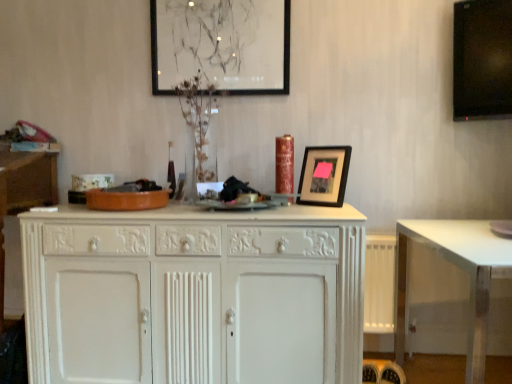
Question: Would you consider black matte picture frame at upper center, which appears as the second picture frame when viewed from the left, to be distant from white painted wood cabinet at center?

Choices:
 (A) yes
 (B) no

Answer: (B)

Question: Does black matte picture frame at upper center, which appears as the second picture frame when viewed from the left, have a larger size compared to white painted wood cabinet at center?

Choices:
 (A) no
 (B) yes

Answer: (A)

Question: From the image's perspective, is black matte picture frame at upper center, acting as the first picture frame starting from the right, located beneath white painted wood cabinet at center?

Choices:
 (A) yes
 (B) no

Answer: (B)

Question: Is black matte picture frame at upper center, which is counted as the 1th picture frame, starting from the bottom, thinner than white painted wood cabinet at center?

Choices:
 (A) no
 (B) yes

Answer: (B)

Question: Could you tell me if black matte picture frame at upper center, the 2th picture frame in the back-to-front sequence, is facing white painted wood cabinet at center?

Choices:
 (A) no
 (B) yes

Answer: (A)

Question: Is black matte picture frame at upper center, which is counted as the 1th picture frame, starting from the bottom, to the left of white painted wood cabinet at center from the viewer's perspective?

Choices:
 (A) no
 (B) yes

Answer: (A)

Question: Is black matte picture frame at upper center, the 1th picture frame positioned from the left, bigger than white painted wood cabinet at center?

Choices:
 (A) yes
 (B) no

Answer: (B)

Question: Considering the relative sizes of black matte picture frame at upper center, which is the 1th picture frame from top to bottom, and white painted wood cabinet at center in the image provided, is black matte picture frame at upper center, which is the 1th picture frame from top to bottom, smaller than white painted wood cabinet at center?

Choices:
 (A) no
 (B) yes

Answer: (B)

Question: Is black matte picture frame at upper center, which is the 1th picture frame from top to bottom, not near white painted wood cabinet at center?

Choices:
 (A) yes
 (B) no

Answer: (A)

Question: Would you say black matte picture frame at upper center, which is the 1th picture frame from top to bottom, is outside white painted wood cabinet at center?

Choices:
 (A) no
 (B) yes

Answer: (B)

Question: Can you confirm if black matte picture frame at upper center, arranged as the 1th picture frame when viewed from the back, is thinner than white painted wood cabinet at center?

Choices:
 (A) yes
 (B) no

Answer: (A)

Question: Does black matte picture frame at upper center, which is the 2th picture frame in right-to-left order, have a lesser height compared to white painted wood cabinet at center?

Choices:
 (A) yes
 (B) no

Answer: (A)

Question: Is clear glass vase at center shorter than white painted wood cabinet at center?

Choices:
 (A) yes
 (B) no

Answer: (A)